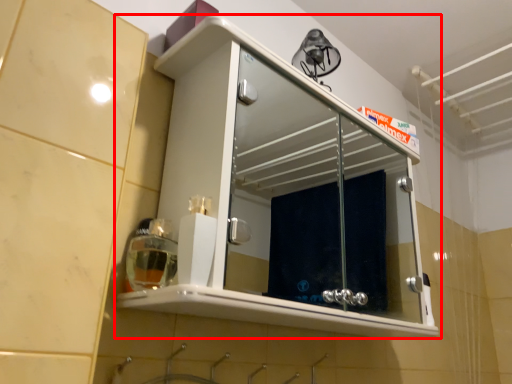
Question: From the image's perspective, where is cabinetry (annotated by the red box) located relative to soap dispenser?

Choices:
 (A) below
 (B) above

Answer: (B)